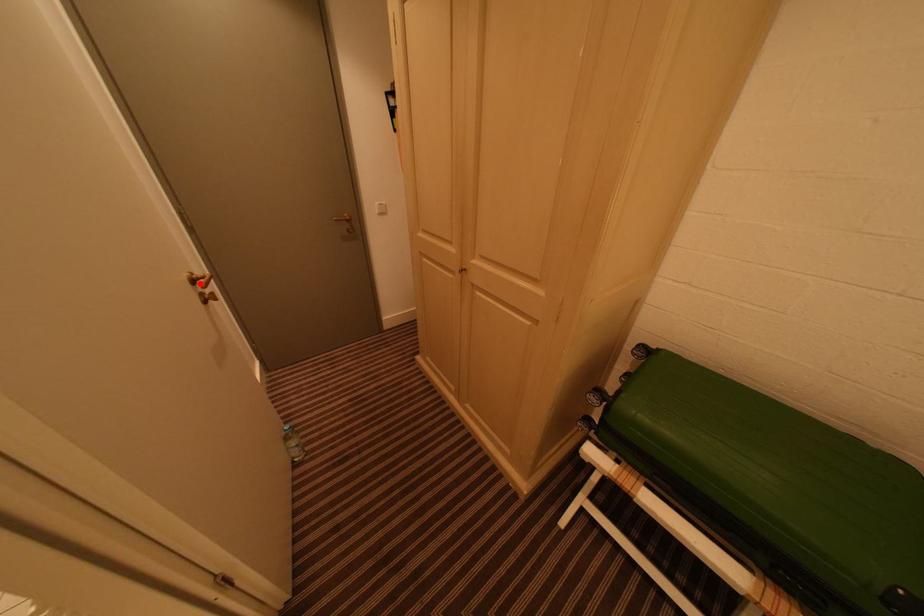
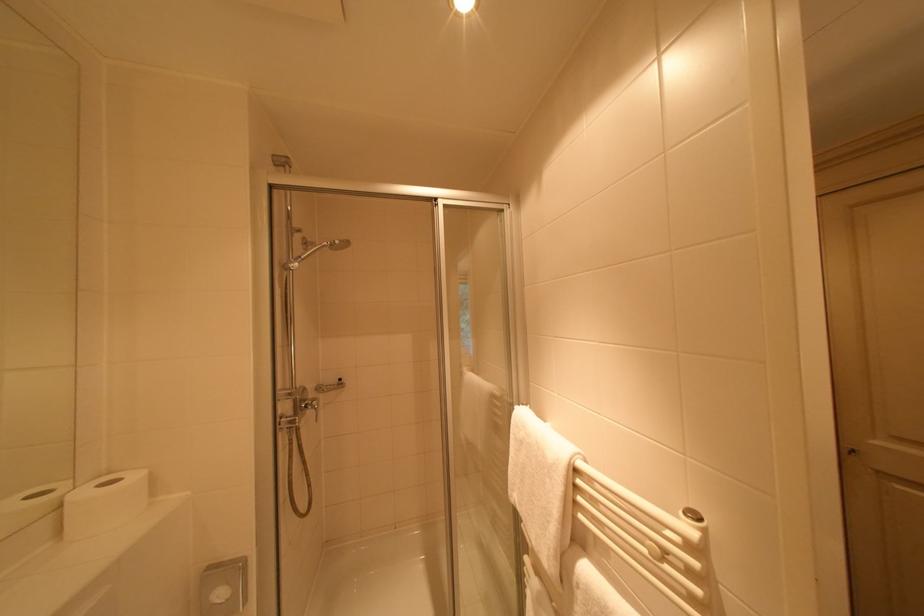
Question: I am providing you with two images of the same scene from different viewpoints. A red point is marked on the first image. Can you still see the location of the red point in image 2?

Choices:
 (A) Yes
 (B) No

Answer: (B)